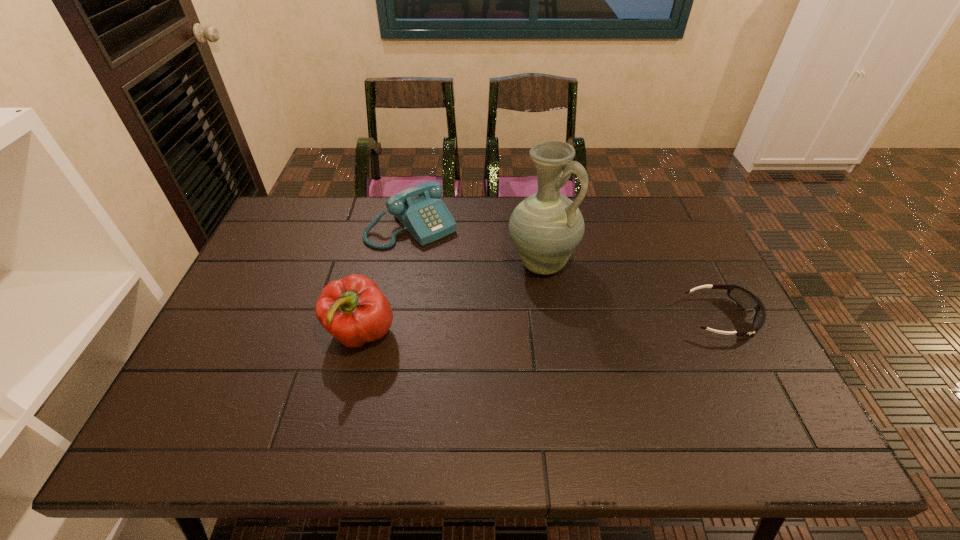
Identify the location of free space that is in between the bell pepper and the shortest object. This screenshot has height=540, width=960. (541, 326).

Find the location of a particular element. vacant region between the third shortest object and the goggles is located at coordinates (541, 326).

Identify the location of free space between the third tallest object and the rightmost object. (566, 272).

Find the location of a particular element. unoccupied position between the tallest object and the goggles is located at coordinates (631, 291).

Identify the location of free spot between the pitcher and the third tallest object. (476, 245).

I want to click on vacant space that is in between the telephone and the goggles, so click(566, 272).

Identify the location of vacant area that lies between the bell pepper and the tallest object. Image resolution: width=960 pixels, height=540 pixels. (451, 299).

Where is `blank region between the tallest object and the goggles`? The width and height of the screenshot is (960, 540). blank region between the tallest object and the goggles is located at coordinates (631, 291).

This screenshot has width=960, height=540. In order to click on vacant area between the second object from right to left and the second shortest object in this screenshot , I will do `click(476, 245)`.

Locate an element on the screen. The image size is (960, 540). vacant space in between the tallest object and the bell pepper is located at coordinates (451, 299).